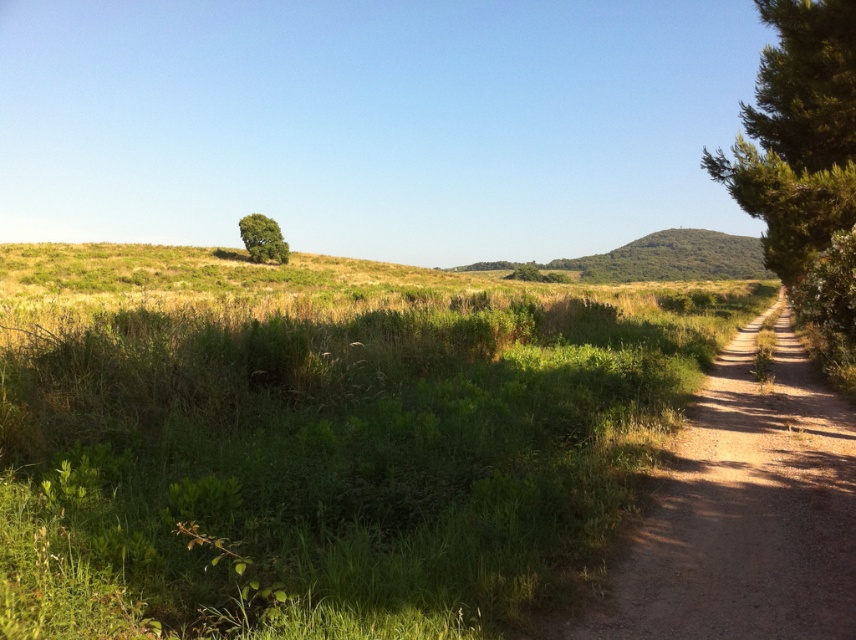
Measure the distance between green leafy tree at right and camera.

green leafy tree at right and camera are 12.73 meters apart from each other.

Can you confirm if green leafy tree at right is positioned above green leafy tree at upper left?

Correct, green leafy tree at right is located above green leafy tree at upper left.

Between point (835, 97) and point (259, 237), which one is positioned in front?

Point (835, 97) is more forward.

At what (x,y) coordinates should I click in order to perform the action: click on green leafy tree at right. Please return your answer as a coordinate pair (x, y). The height and width of the screenshot is (640, 856). Looking at the image, I should click on (798, 132).

Is point (765, 570) positioned after point (262, 234)?

No, (765, 570) is in front of (262, 234).

Locate an element on the screen. dirt/gravel path at center-right is located at coordinates (742, 513).

Does dirt/gravel path at center-right have a larger size compared to green leafy tree at right?

No.

Is dirt/gravel path at center-right further to camera compared to green leafy tree at right?

No.

Describe the element at coordinates (742, 513) in the screenshot. I see `dirt/gravel path at center-right` at that location.

Find the location of a particular element. dirt/gravel path at center-right is located at coordinates (742, 513).